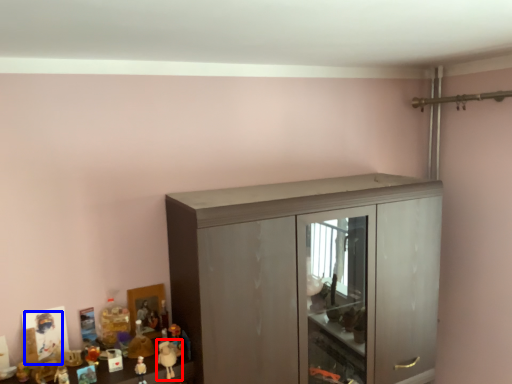
Question: Which object appears farthest to the camera in this image, toy (highlighted by a red box) or toy (highlighted by a blue box)?

Choices:
 (A) toy
 (B) toy

Answer: (B)